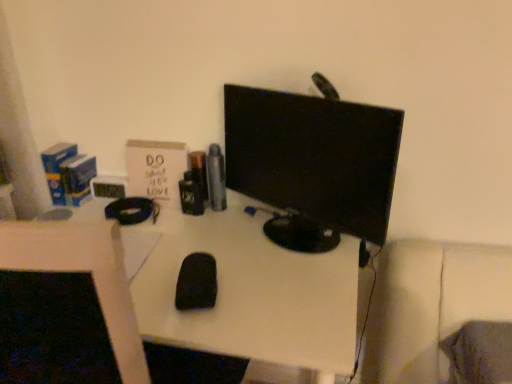
The image size is (512, 384). Identify the location of free space between black glossy monitor at center and black matte mouse at center. (261, 264).